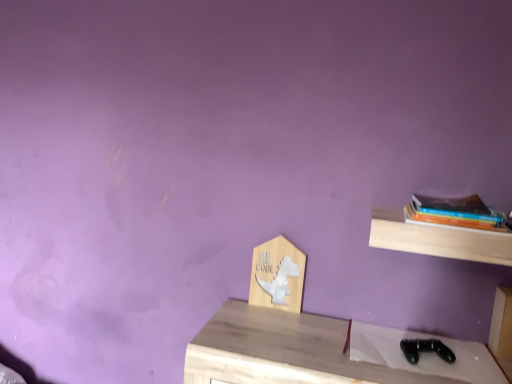
Where is `free space above light wood shelf at upper right, the 2th shelf from the left (from a real-world perspective)`? free space above light wood shelf at upper right, the 2th shelf from the left (from a real-world perspective) is located at coordinates (442, 224).